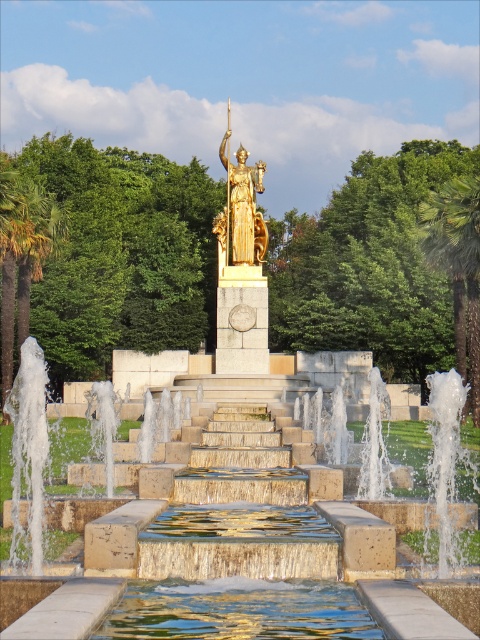
You are a photographer planning to capture the fountain and the palm tree in a single shot. Given that the clear glass water at center is smaller than the green leafy palm tree at right, which object should you position closer to the camera to ensure both fit within the frame?

To ensure both the clear glass water at center and the green leafy palm tree at right fit within the frame, you should position the clear glass water at center closer to the camera since it is smaller compared to the palm tree, allowing for better framing and composition.

You are standing in the park and want to take a photo of the gold polished statue at center with the green leafy palm tree at right in the background. Is the palm tree positioned to the right side of the statue?

Yes, the green leafy palm tree at right is positioned to the right of the gold polished statue at center, so it will appear in the background when taking the photo.